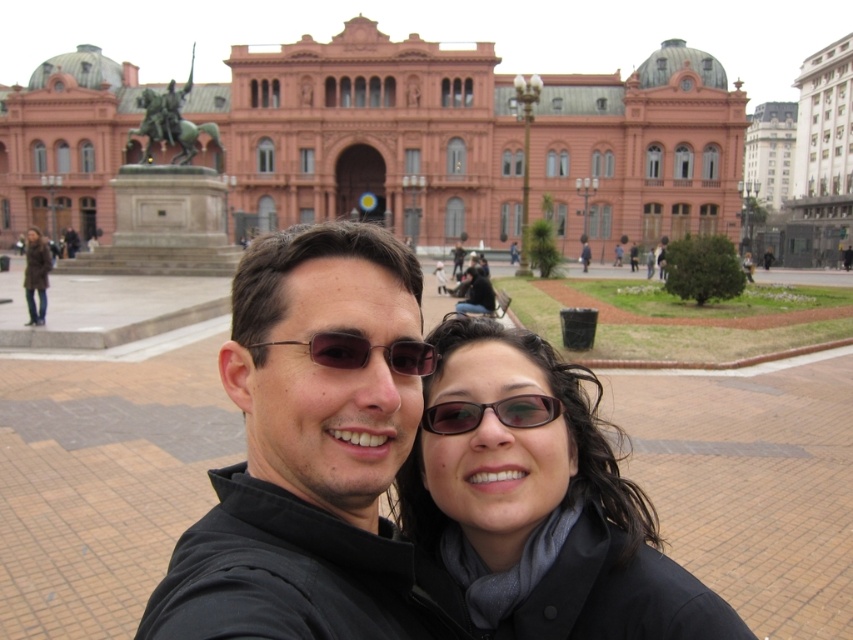
You are standing in front of the historic building and want to take a photo. You notice two points marked in the scene. Which point is closer to you, point (x=589, y=444) or point (x=440, y=467)?

Point (x=589, y=444) is closer to you because it is further to the viewer than point (x=440, y=467).

You are a tailor who needs to determine which jacket requires more fabric to alter. Based on the image, which jacket between the black matte jacket at center and the brown leather jacket at upper left would need more fabric due to its size?

The black matte jacket at center requires more fabric for alterations because it has a larger size compared to the brown leather jacket at upper left.